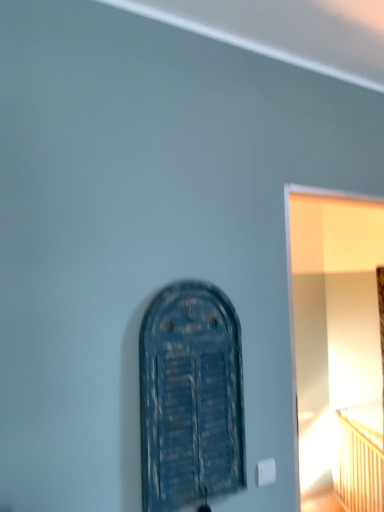
Question: Looking at their shapes, would you say blue wooden door at center is wider or thinner than wooden bed at right?

Choices:
 (A) wide
 (B) thin

Answer: (B)

Question: Considering their positions, is blue wooden door at center located in front of or behind wooden bed at right?

Choices:
 (A) front
 (B) behind

Answer: (A)

Question: Estimate the real-world distances between objects in this image. Which object is farther from the white glossy door at right?

Choices:
 (A) blue wooden door at center
 (B) wooden bed at right

Answer: (A)

Question: Estimate the real-world distances between objects in this image. Which object is farther from the white glossy door at right?

Choices:
 (A) wooden bed at right
 (B) blue wooden door at center

Answer: (B)